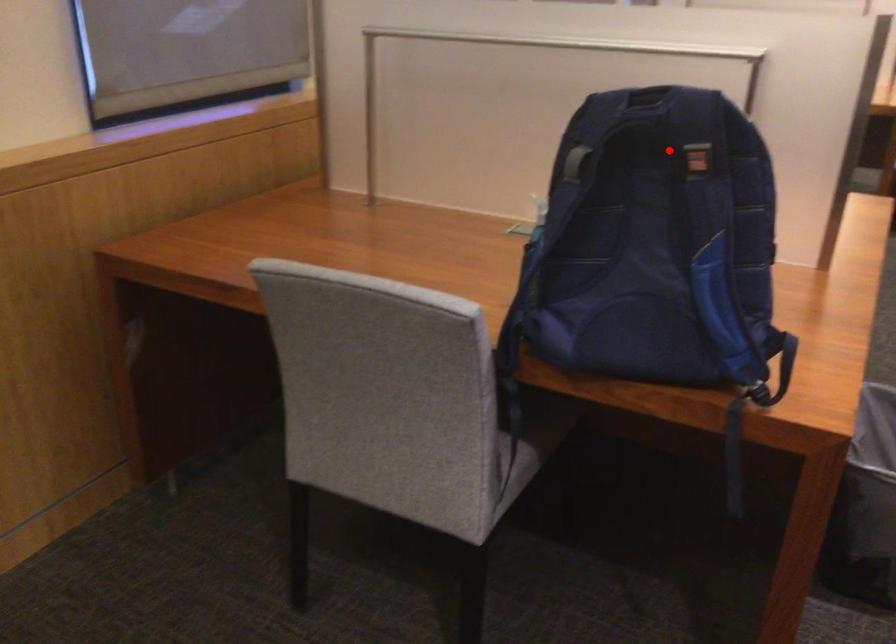
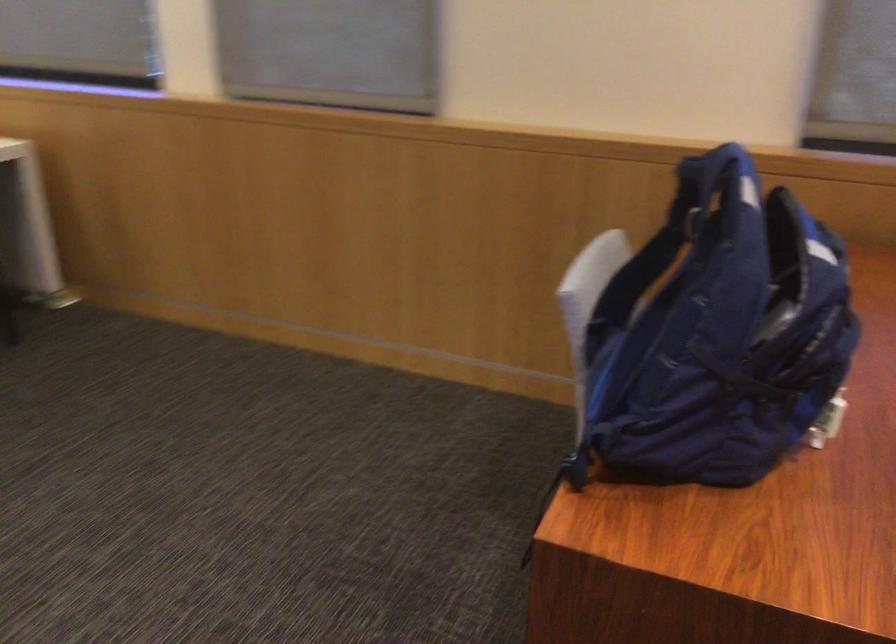
Find the pixel in the second image that matches the highlighted location in the first image.

(687, 216)